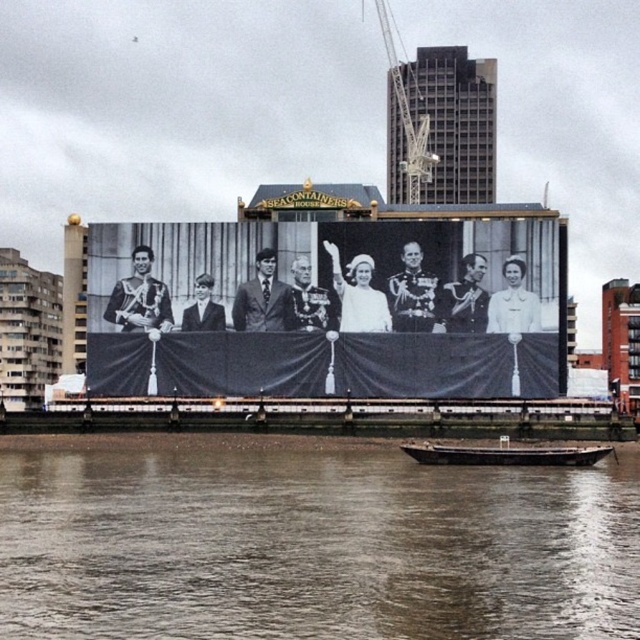
Which is more to the left, rusty metal barge at lower center or metallic gray crane at upper center?

metallic gray crane at upper center is more to the left.

Between point (509, 456) and point (394, 81), which one is positioned in front?

Point (509, 456)

Identify the location of rusty metal barge at lower center. This screenshot has width=640, height=640. (502, 454).

Does brown water at lower center have a larger size compared to rusty metal barge at lower center?

Correct, brown water at lower center is larger in size than rusty metal barge at lower center.

Is point (163, 612) positioned behind point (534, 461)?

No, (163, 612) is closer to viewer.

Where is `brown water at lower center`? The height and width of the screenshot is (640, 640). brown water at lower center is located at coordinates (308, 541).

How much distance is there between black and white photograph at center and rusty metal barge at lower center?

black and white photograph at center and rusty metal barge at lower center are 14.27 meters apart.

Which of these two, black and white photograph at center or rusty metal barge at lower center, stands shorter?

Standing shorter between the two is rusty metal barge at lower center.

Find the location of a particular element. The width and height of the screenshot is (640, 640). black and white photograph at center is located at coordinates (326, 308).